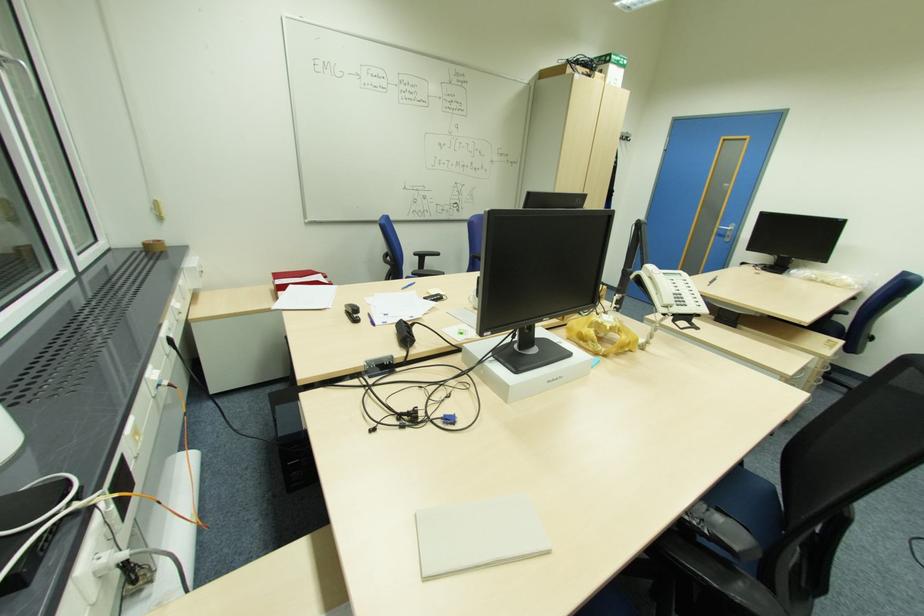
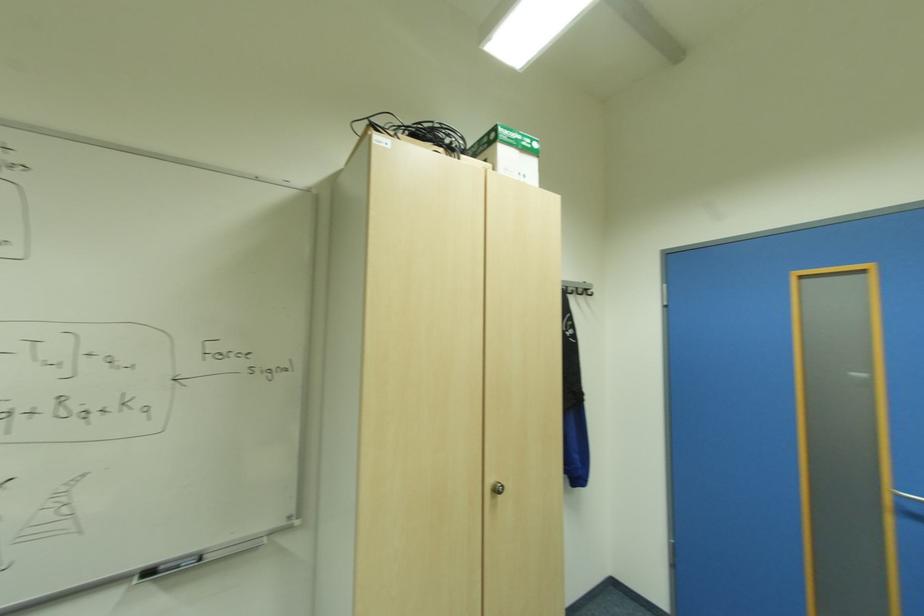
The images are taken continuously from a first-person perspective. In which direction are you moving?

The cameraman moved toward right, forward.